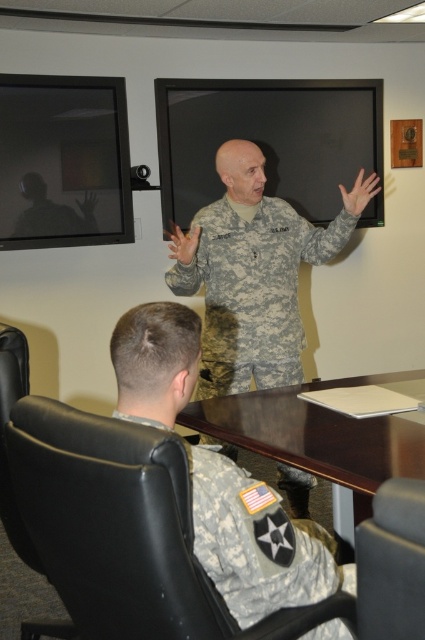
You are a guest entering the conference room and need to choose a seat. There is a black leather chair at lower left and a matte black chair at lower right. Which chair would you choose if you want to sit in the larger one?

The black leather chair at lower left is larger in size compared to the matte black chair at lower right, so you should choose the black leather chair at lower left.

What object is located at the coordinate point (252,289) in the image?

The camouflage fabric uniform at center is located at the coordinate point (252,289).

You are a photographer setting up for a formal portrait in the conference room. You need to ensure that the camouflage fabric uniform at center is visible without being obscured by the brown wood table at center. Is this possible given the current setup?

The camouflage fabric uniform at center is positioned over the brown wood table at center, so it is currently obscuring the table and may not be fully visible. Adjust the uniform or table position to ensure visibility.